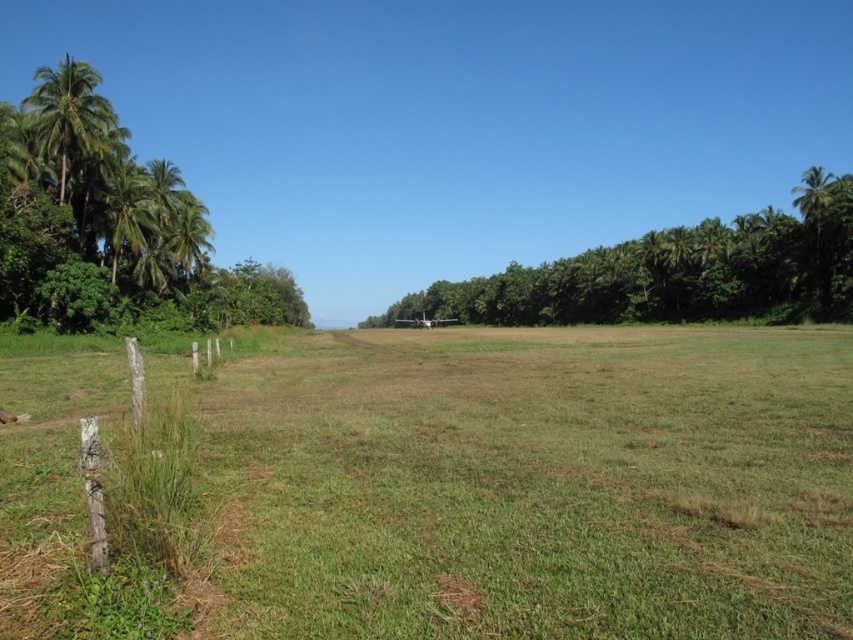
Question: Which object appears closest to the camera in this image?

Choices:
 (A) green leafy palm tree at upper left
 (B) green leafy palm tree at right
 (C) green leafy trees at center

Answer: (A)

Question: Does weathered wood fence at lower left appear over green leafy palm tree at upper left?

Choices:
 (A) yes
 (B) no

Answer: (B)

Question: Does green leafy trees at center have a greater width compared to green leafy palm tree at left?

Choices:
 (A) yes
 (B) no

Answer: (A)

Question: Which point is farther to the camera?

Choices:
 (A) green grassy field at center
 (B) green leafy trees at center
 (C) green leafy palm tree at left

Answer: (B)

Question: Based on their relative distances, which object is nearer to the weathered wood fence at lower left?

Choices:
 (A) green leafy trees at center
 (B) green grassy field at center
 (C) green leafy palm tree at right

Answer: (B)

Question: Does green leafy palm tree at upper left have a greater width compared to green leafy palm tree at left?

Choices:
 (A) yes
 (B) no

Answer: (A)